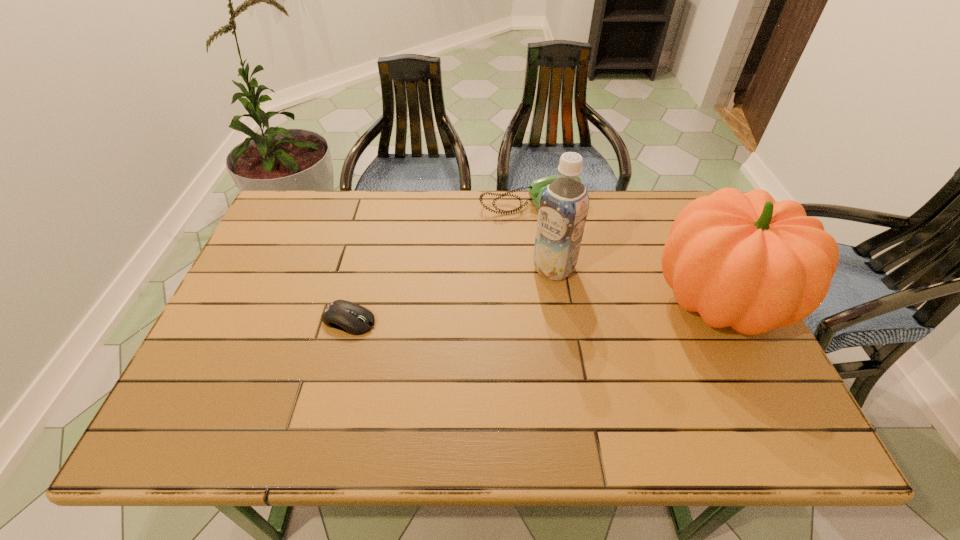
Locate an element on the screen. The height and width of the screenshot is (540, 960). vacant space on the desktop that is between the computer equipment and the pumpkin and is positioned on the dial of the farthest object is located at coordinates (587, 308).

What are the coordinates of `free spot on the desktop that is between the leftmost object and the pumpkin and is positioned on the label of the soya milk` in the screenshot? It's located at (503, 312).